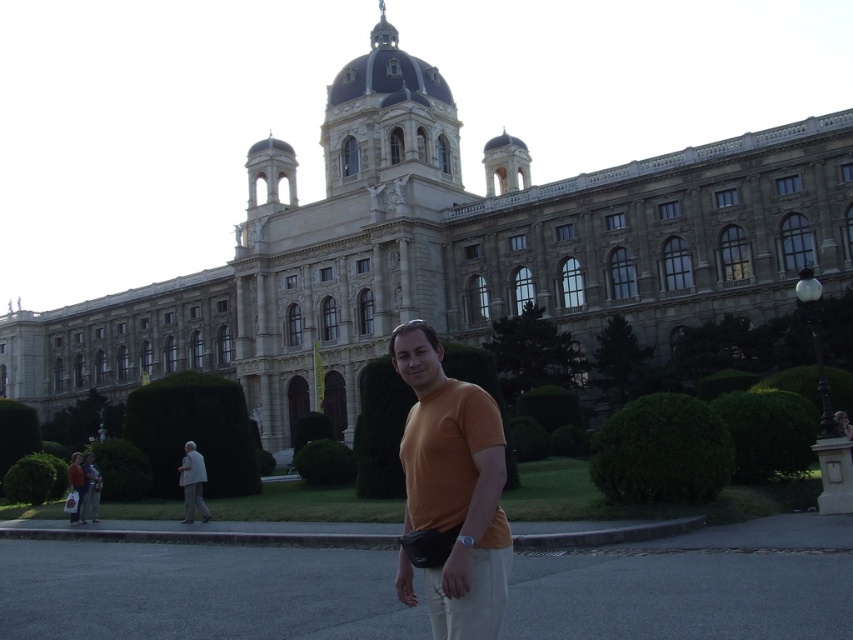
What do you see at coordinates (450, 250) in the screenshot? I see `gray stone building at center` at bounding box center [450, 250].

Who is positioned more to the right, gray stone building at center or light gray fabric jacket at lower left?

From the viewer's perspective, gray stone building at center appears more on the right side.

Who is more forward, (291,209) or (198,490)?

Positioned in front is point (198,490).

At what (x,y) coordinates should I click in order to perform the action: click on gray stone building at center. Please return your answer as a coordinate pair (x, y). The width and height of the screenshot is (853, 640). Looking at the image, I should click on (450, 250).

Is orange cotton shirt at center in front of light gray fabric jacket at lower left?

Yes, it is.

Who is shorter, orange cotton shirt at center or light gray fabric jacket at lower left?

Standing shorter between the two is light gray fabric jacket at lower left.

You are a GUI agent. You are given a task and a screenshot of the screen. Output one action in this format:
    pyautogui.click(x=<x>, y=<y>)
    Task: Click on the orange cotton shirt at center
    The image size is (853, 640).
    Given the screenshot: What is the action you would take?
    click(451, 493)

Does gray stone building at center have a smaller size compared to orange cotton shirt at center?

Actually, gray stone building at center might be larger than orange cotton shirt at center.

Is point (13, 365) positioned in front of point (433, 344)?

No.

Locate an element on the screen. Image resolution: width=853 pixels, height=640 pixels. gray stone building at center is located at coordinates (450, 250).